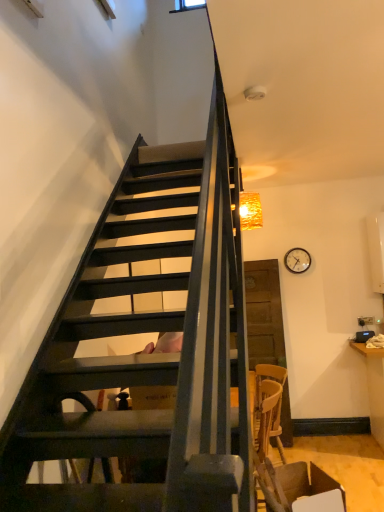
Question: In terms of size, does wooden clock at upper right appear bigger or smaller than crinkled gold lampshade at upper right?

Choices:
 (A) small
 (B) big

Answer: (A)

Question: Is wooden clock at upper right taller or shorter than crinkled gold lampshade at upper right?

Choices:
 (A) tall
 (B) short

Answer: (B)

Question: Considering the real-world distances, which object is closest to the wooden clock at upper right?

Choices:
 (A) brown leather armchair at lower right
 (B) crinkled gold lampshade at upper right

Answer: (B)

Question: Based on their relative distances, which object is nearer to the brown leather armchair at lower right?

Choices:
 (A) crinkled gold lampshade at upper right
 (B) wooden clock at upper right

Answer: (A)